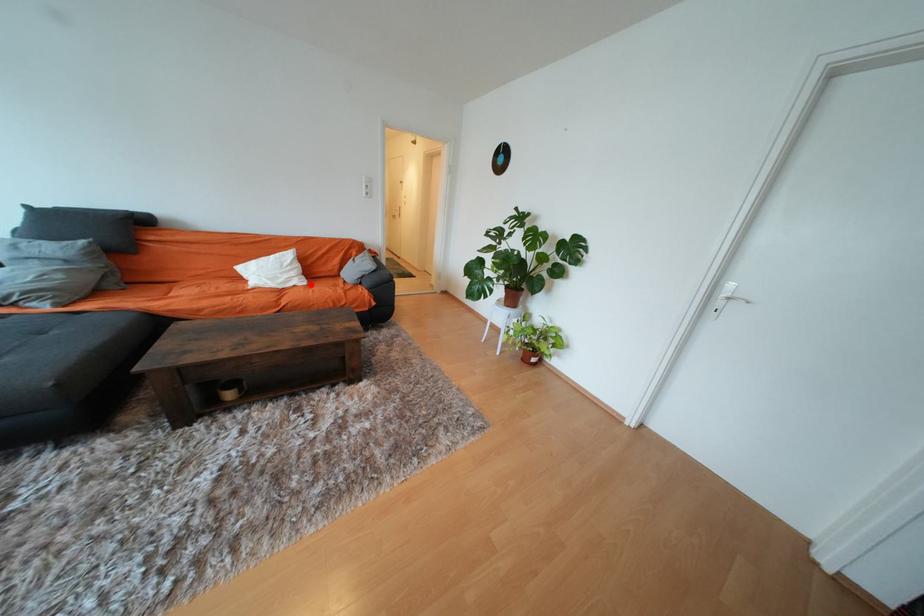
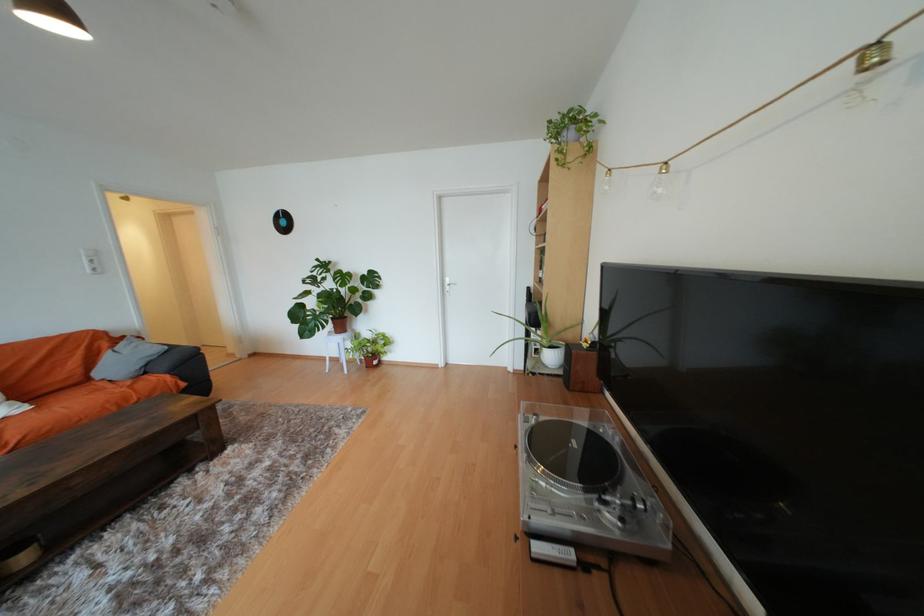
In the second image, find the point that corresponds to the highlighted location in the first image.

(31, 410)